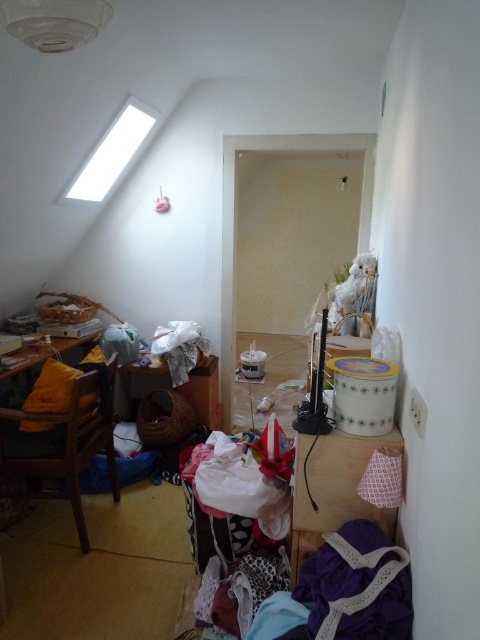
Describe the element at coordinates (357, 586) in the screenshot. This screenshot has height=640, width=480. I see `purple lace fabric at lower right` at that location.

Who is more distant from viewer, (325, 618) or (155, 376)?

Point (155, 376)

Where is `purple lace fabric at lower right`? Image resolution: width=480 pixels, height=640 pixels. purple lace fabric at lower right is located at coordinates (357, 586).

In the scene shown: Which is above, purple lace fabric at lower right or yellow fabric-covered table at left?

yellow fabric-covered table at left is above.

Is point (354, 586) positioned after point (57, 348)?

That is False.

Where is `purple lace fabric at lower right`? The width and height of the screenshot is (480, 640). purple lace fabric at lower right is located at coordinates (357, 586).

Is wooden table at center taller than yellow fabric-covered table at left?

Yes.

Is point (208, 355) more distant than point (12, 372)?

Yes, point (208, 355) is behind point (12, 372).

Is point (152, 380) positioned in front of point (84, 336)?

No, (152, 380) is further to viewer.

Where is `wooden table at center`? The height and width of the screenshot is (640, 480). wooden table at center is located at coordinates (204, 392).